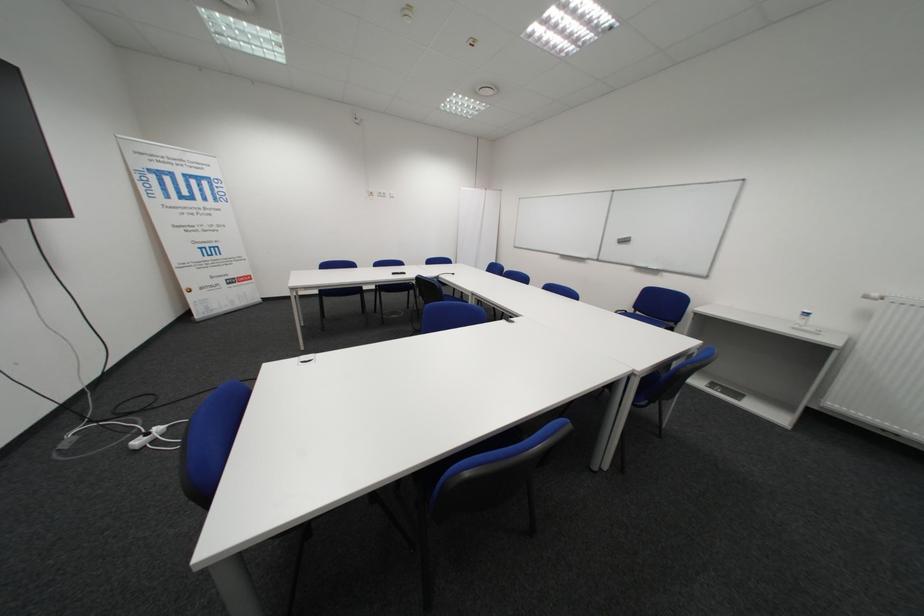
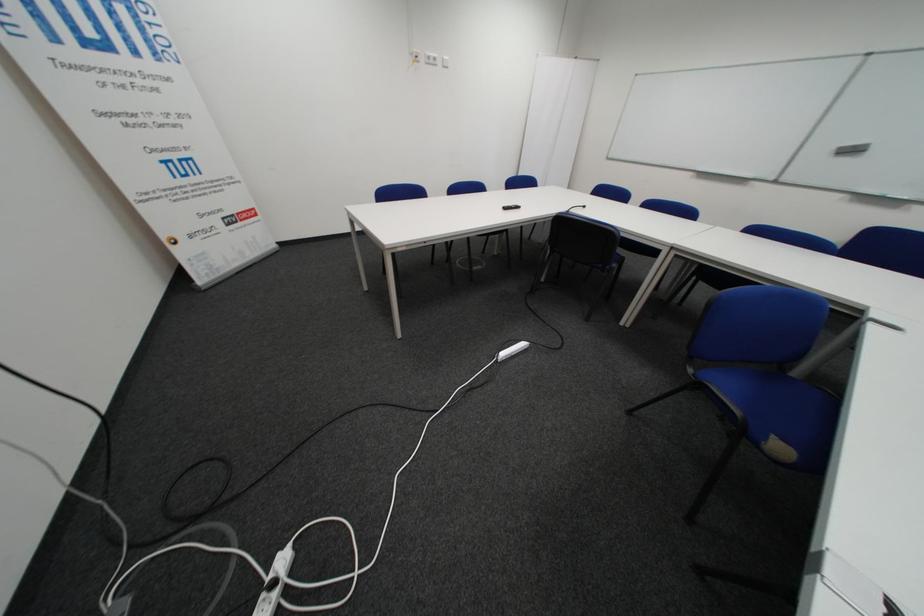
Which direction would the cameraman need to move to produce the second image?

The movement direction of the cameraman is left, forward.